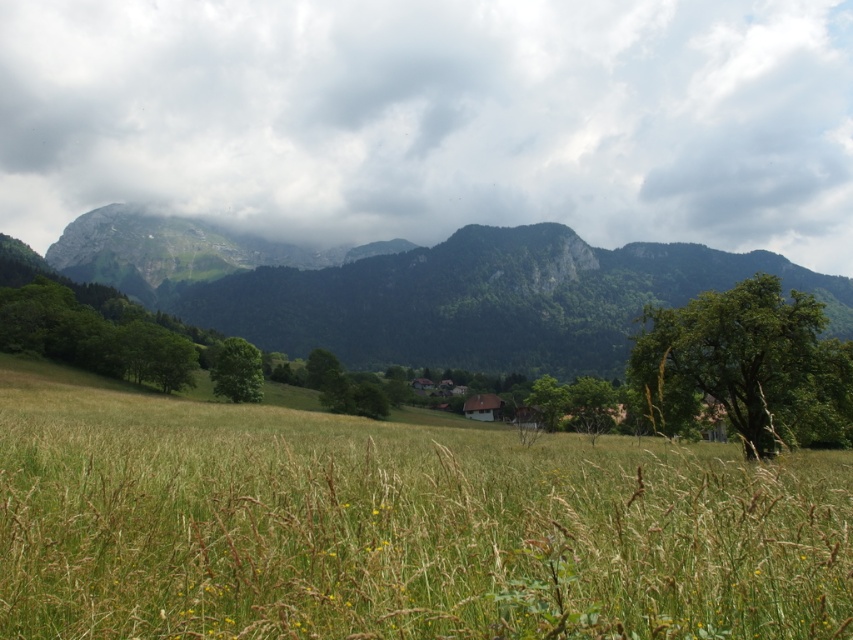
You are standing at the point with coordinates point (421, 289) in the image. What object are you looking at?

You are looking at the green rocky mountain at center.

You are standing in the middle of the grassy field and looking towards the green rocky mountain at center. Can you see the cloudy sky at upper center above the mountain?

The green rocky mountain at center is behind cloudy sky at upper center, so yes, the cloudy sky at upper center is visible above the mountain when viewed from the field.